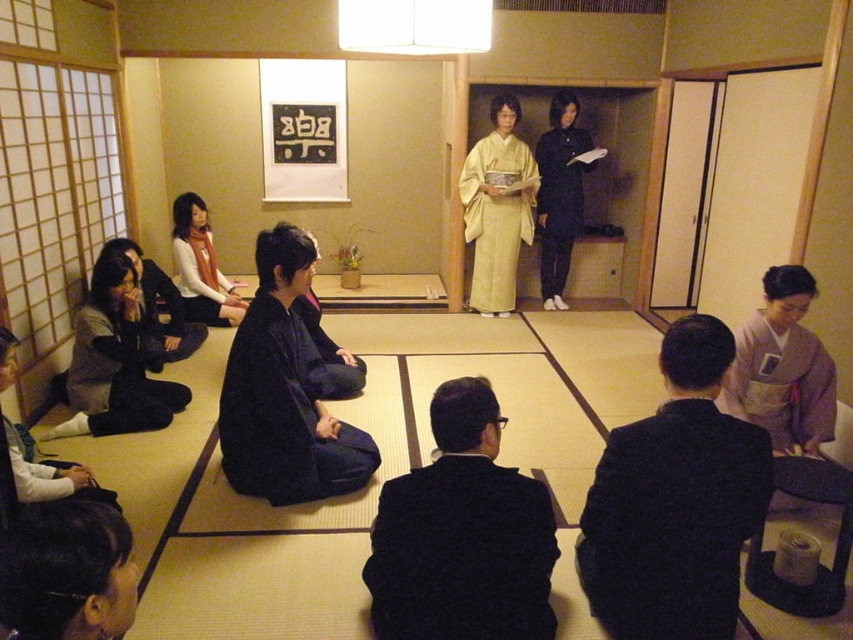
Between point (619, 432) and point (138, 340), which one is positioned in front?

Point (619, 432) is in front.

Which is behind, point (659, 440) or point (94, 356)?

Point (94, 356)

I want to click on dark blue suit at lower right, so (675, 500).

Consider the image. Does black matte kimono at center have a greater width compared to black silk kimono at center?

Yes.

Is black matte kimono at center thinner than black silk kimono at center?

In fact, black matte kimono at center might be wider than black silk kimono at center.

Image resolution: width=853 pixels, height=640 pixels. I want to click on black matte kimono at center, so [x=560, y=193].

Find the location of a particular element. This screenshot has height=640, width=853. black matte kimono at center is located at coordinates (560, 193).

Does point (173, 356) come behind point (12, 461)?

Yes, point (173, 356) is farther from viewer.

Which is in front, point (149, 369) or point (6, 444)?

Point (6, 444) is more forward.

Is point (189, 333) closer to viewer compared to point (73, 477)?

No, it is not.

Where is `dark blue fabric kimono at lower left`? dark blue fabric kimono at lower left is located at coordinates (158, 310).